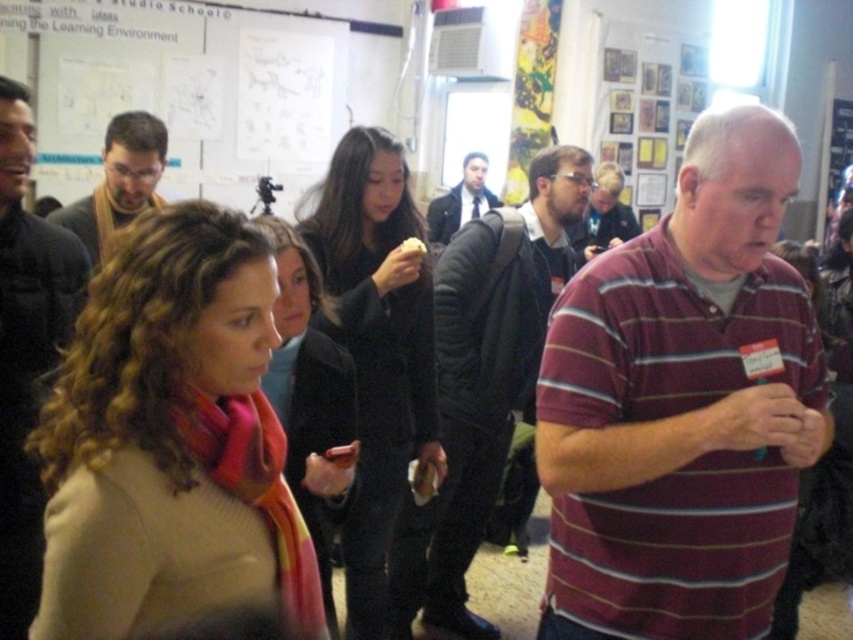
You are standing in the room and want to hand a document to the person wearing the black matte coat at center and the dark suit jacket at center. Which one can you reach first without moving closer?

The black matte coat at center is closer to the viewer than the dark suit jacket at center, so you can reach the person wearing the black matte coat at center first without moving closer.

You are standing in the center of the room and want to move to the dark gray jacket at center. Which direction should you move to reach it?

Since the dark gray jacket at center is located at the center of the room, you are already at the correct position to reach it.

You are organizing a photo shoot and need to adjust the lighting. The dark gray jacket at center and dark gray scarf at center are currently 4.09 feet apart. To ensure both items are evenly lit, what minimum distance should the lighting equipment be placed from each object?

The lighting equipment should be placed at least 4.09 feet away from both the dark gray jacket at center and dark gray scarf at center to ensure even lighting.